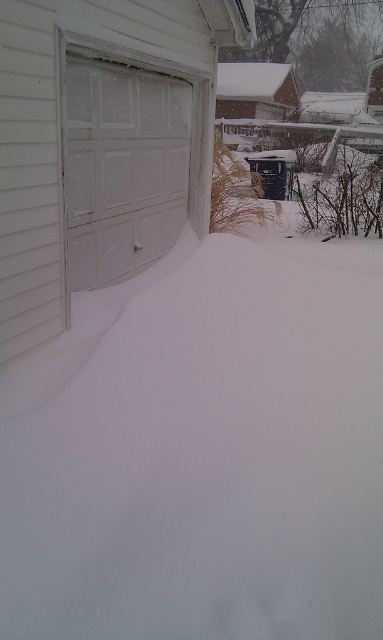
Question: Among these points, which one is nearest to the camera?

Choices:
 (A) (60, 35)
 (B) (147, 253)

Answer: (A)

Question: Does white matte garage door at left lie in front of white frosted garage door at left?

Choices:
 (A) no
 (B) yes

Answer: (B)

Question: Which object appears farthest from the camera in this image?

Choices:
 (A) white matte garage door at left
 (B) white frosted garage door at left

Answer: (B)

Question: Which point is closer to the camera taking this photo?

Choices:
 (A) (44, 67)
 (B) (117, 118)

Answer: (A)

Question: Does white matte garage door at left appear on the right side of white frosted garage door at left?

Choices:
 (A) yes
 (B) no

Answer: (A)

Question: Is white matte garage door at left positioned behind white frosted garage door at left?

Choices:
 (A) no
 (B) yes

Answer: (A)